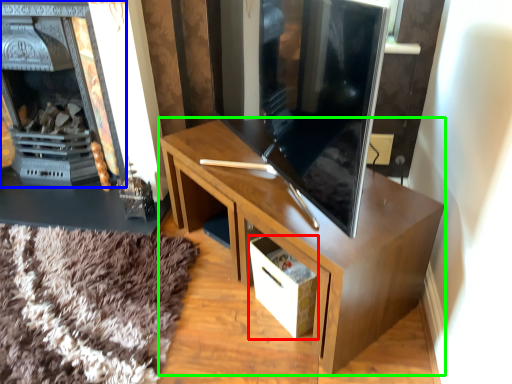
Question: Considering the real-world distances, which object is farthest from drawer (highlighted by a red box)? fireplace (highlighted by a blue box) or desk (highlighted by a green box)?

Choices:
 (A) fireplace
 (B) desk

Answer: (A)